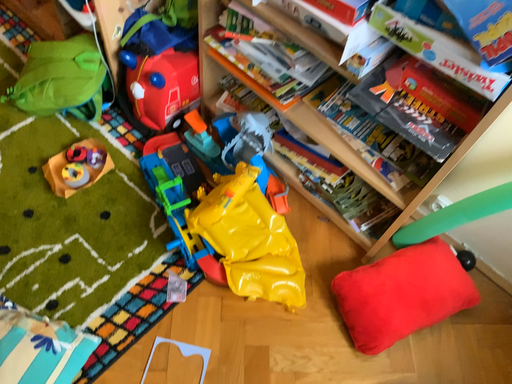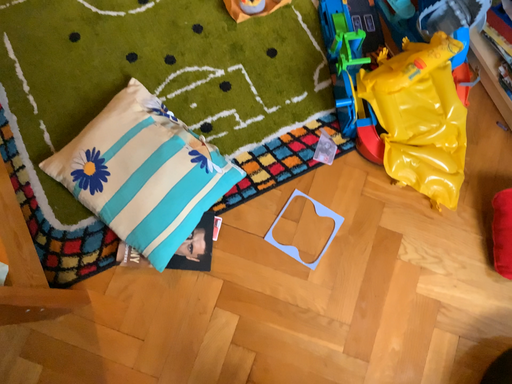
Question: How did the camera likely rotate when shooting the video?

Choices:
 (A) rotated right
 (B) rotated left

Answer: (B)